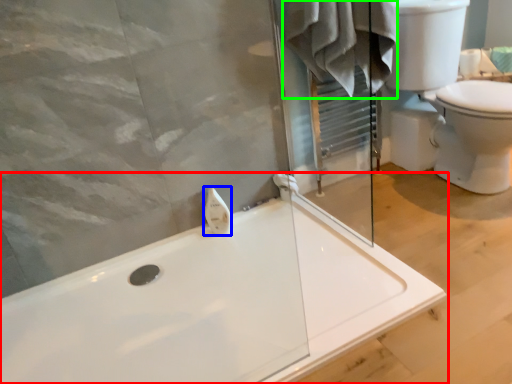
Question: Considering the real-world distances, which object is farthest from bathtub (highlighted by a red box)? toiletry (highlighted by a blue box) or bathrobe (highlighted by a green box)?

Choices:
 (A) toiletry
 (B) bathrobe

Answer: (B)